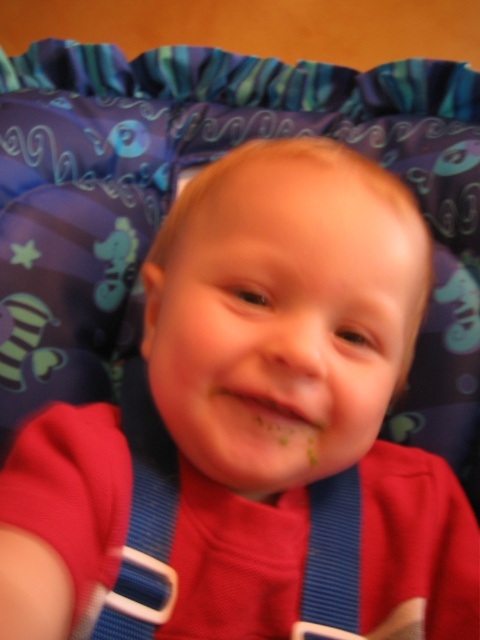
You are a photographer taking a picture of the child in the high chair. You notice two points in the image at coordinates point (310,323) and point (136,611). Which point is closer to the camera?

Point (310,323) is in front of point (136,611), so it is closer to the camera.

You are a photographer standing at a certain distance from the smooth skin face at center. You want to capture a close portrait without any distortion. Considering the ideal focal length for a portrait is around 85mm, what focal length should you use to maintain the recommended 24cm working distance for optimal sharpness and minimal distortion?

The smooth skin face at center is 26.76 centimeters away from the viewer. Since the recommended working distance is 24cm, you should increase the focal length slightly to compensate for the extra distance. A focal length of approximately 90mm would maintain sharpness and reduce distortion at 26.76cm.